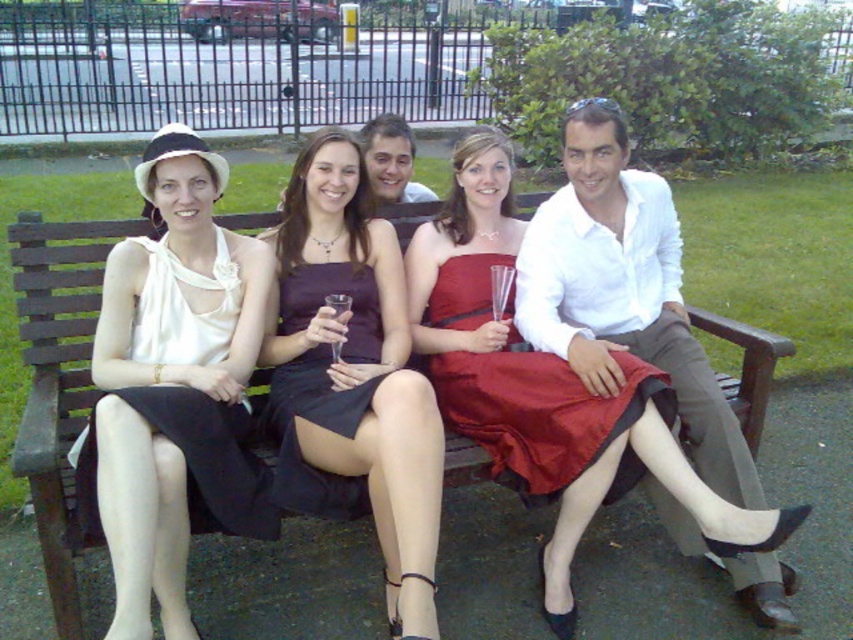
Question: Which object appears closest to the camera in this image?

Choices:
 (A) matte white dress at left
 (B) matte purple dress at center

Answer: (A)

Question: In this image, where is satin red dress at center located relative to dark purple satin dress at center?

Choices:
 (A) above
 (B) below

Answer: (A)

Question: In this image, where is matte white dress at left located relative to white cotton shirt at center?

Choices:
 (A) left
 (B) right

Answer: (A)

Question: Considering the real-world distances, which object is closest to the dark purple satin dress at center?

Choices:
 (A) matte white dress at left
 (B) smooth white shirt at center
 (C) transparent glass at center

Answer: (C)

Question: Is matte purple dress at center to the left of smooth white shirt at center from the viewer's perspective?

Choices:
 (A) no
 (B) yes

Answer: (B)

Question: Which point is closer to the camera?

Choices:
 (A) (407, 136)
 (B) (614, 177)

Answer: (B)